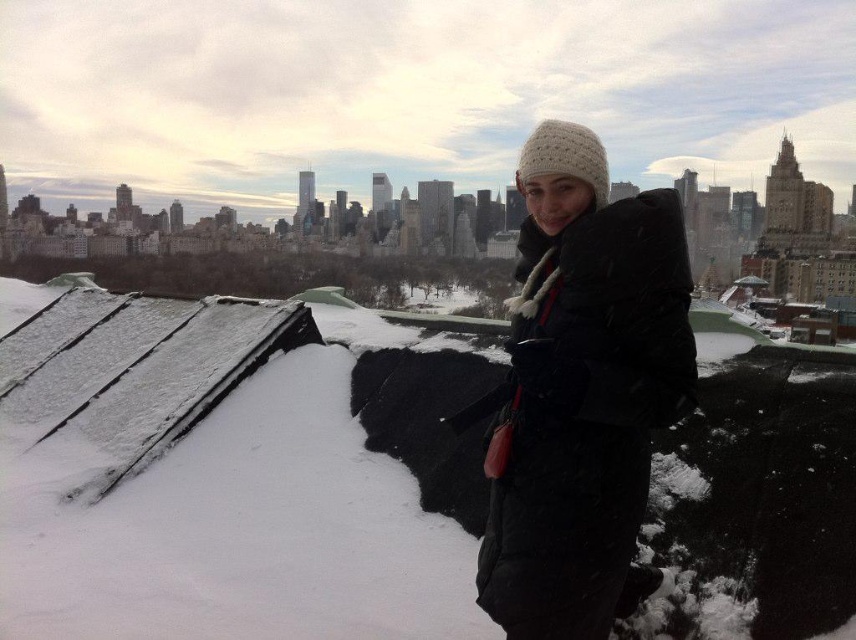
From the picture: Is white fluffy snow at center smaller than matte black coat at center?

Incorrect, white fluffy snow at center is not smaller in size than matte black coat at center.

Between point (146, 410) and point (657, 392), which one is positioned in front?

Point (657, 392) is in front.

Identify the location of white fluffy snow at center. (238, 474).